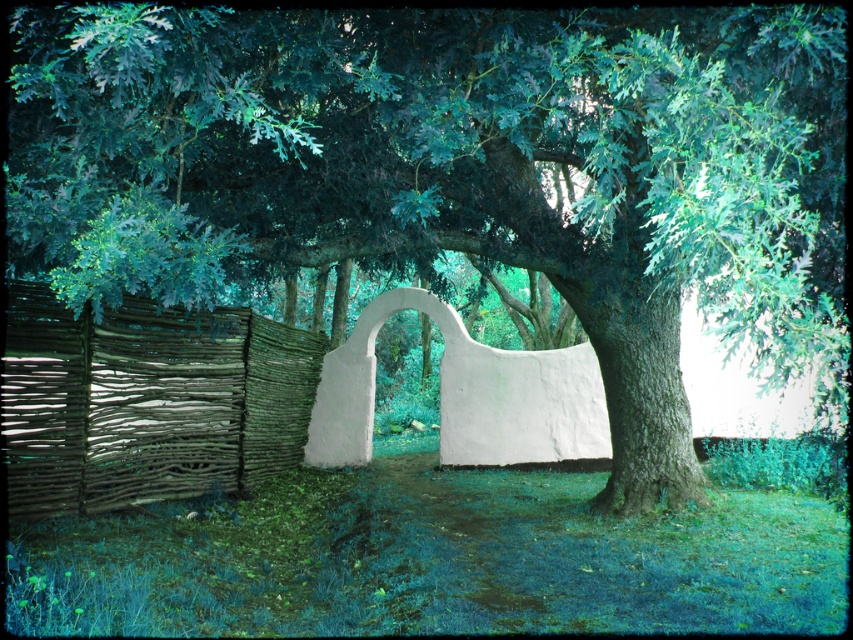
Can you confirm if brown woven fence at left is positioned to the right of white matte archway at center?

In fact, brown woven fence at left is to the left of white matte archway at center.

Which is in front, point (38, 497) or point (456, 321)?

Positioned in front is point (38, 497).

At what (x,y) coordinates should I click in order to perform the action: click on brown woven fence at left. Please return your answer as a coordinate pair (x, y). This screenshot has height=640, width=853. Looking at the image, I should click on (148, 403).

This screenshot has width=853, height=640. What are the coordinates of `brown woven fence at left` in the screenshot? It's located at (148, 403).